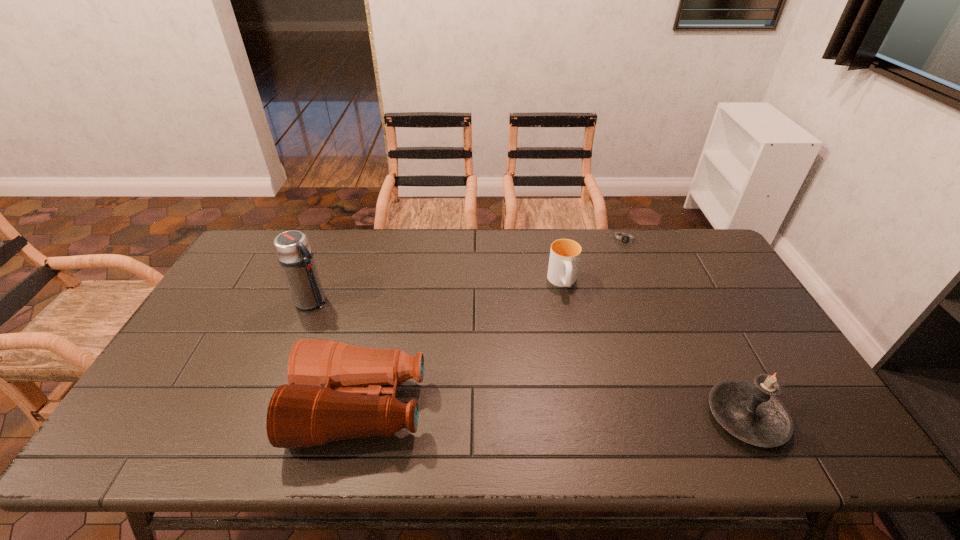
In order to click on free spot located with a handle on the side of the thermos bottle in this screenshot , I will do [396, 348].

Image resolution: width=960 pixels, height=540 pixels. I want to click on free space located with a handle on the side of the thermos bottle, so click(375, 336).

Where is `cup at the far edge`? Image resolution: width=960 pixels, height=540 pixels. cup at the far edge is located at coordinates (564, 259).

You are a GUI agent. You are given a task and a screenshot of the screen. Output one action in this format:
    pyautogui.click(x=<x>, y=<y>)
    Task: Click on the watch that is at the far edge
    Image resolution: width=960 pixels, height=540 pixels.
    Given the screenshot: What is the action you would take?
    pyautogui.click(x=625, y=239)

You are a GUI agent. You are given a task and a screenshot of the screen. Output one action in this format:
    pyautogui.click(x=<x>, y=<y>)
    Task: Click on the binoculars at the near edge
    
    Given the screenshot: What is the action you would take?
    pyautogui.click(x=324, y=401)

At what (x,y) coordinates should I click in order to perform the action: click on candle present at the near edge. Please return your answer as a coordinate pair (x, y). Image resolution: width=960 pixels, height=540 pixels. Looking at the image, I should click on (751, 412).

The image size is (960, 540). In order to click on object situated at the right edge in this screenshot , I will do `click(751, 412)`.

Where is `object that is positioned at the near right corner`? object that is positioned at the near right corner is located at coordinates (751, 412).

You are a GUI agent. You are given a task and a screenshot of the screen. Output one action in this format:
    pyautogui.click(x=<x>, y=<y>)
    Task: Click on the vacant area at the far edge
    
    Given the screenshot: What is the action you would take?
    pyautogui.click(x=437, y=258)

In the image, there is a desktop. What are the coordinates of `free space at the near edge` in the screenshot? It's located at tap(523, 388).